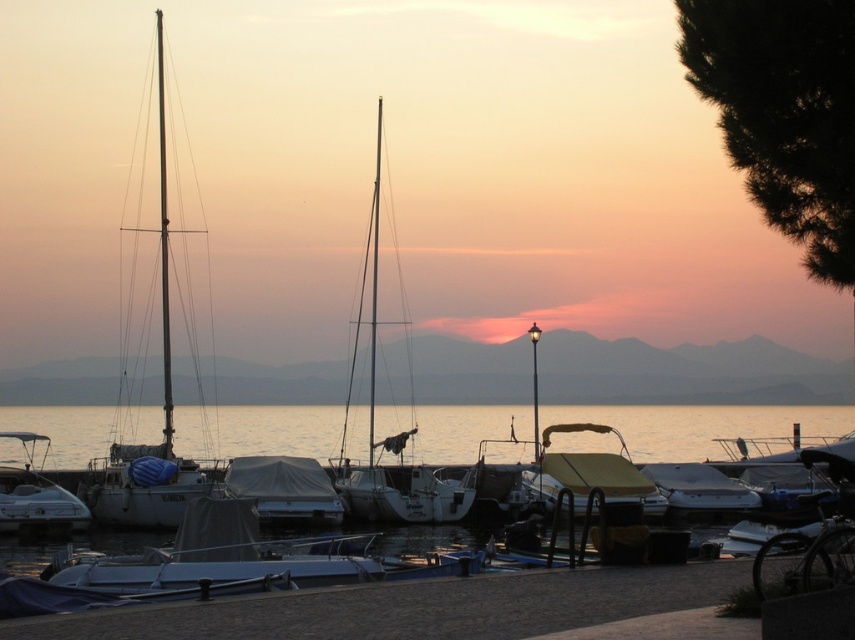
Question: Which of the following is the closest to the observer?

Choices:
 (A) (711, 476)
 (B) (39, 513)

Answer: (B)

Question: Which of the following is the farthest from the observer?

Choices:
 (A) (310, 497)
 (B) (15, 483)
 (C) (641, 474)
 (D) (582, 493)

Answer: (C)

Question: Can you confirm if yellow matte boat at center is bigger than white glossy boat at left?

Choices:
 (A) yes
 (B) no

Answer: (A)

Question: From the image, what is the correct spatial relationship of white tarpaulin boat at center in relation to white matte boat at center?

Choices:
 (A) above
 (B) below

Answer: (A)

Question: Is clear water at center closer to the viewer compared to white matte sailboat at center?

Choices:
 (A) yes
 (B) no

Answer: (A)

Question: Which point is closer to the camera taking this photo?

Choices:
 (A) (270, 460)
 (B) (27, 456)
 (C) (681, 500)
 (D) (376, 499)

Answer: (A)